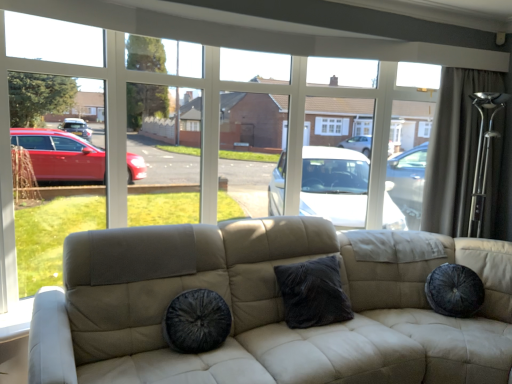
Question: Can you confirm if dark gray fabric curtain at upper right is thinner than velvet dark gray pillow at center?

Choices:
 (A) no
 (B) yes

Answer: (B)

Question: Considering the relative sizes of dark gray fabric curtain at upper right and velvet dark gray pillow at center in the image provided, is dark gray fabric curtain at upper right wider than velvet dark gray pillow at center?

Choices:
 (A) no
 (B) yes

Answer: (A)

Question: Can you confirm if dark gray fabric curtain at upper right is smaller than velvet dark gray pillow at center?

Choices:
 (A) yes
 (B) no

Answer: (B)

Question: Could you tell me if dark gray fabric curtain at upper right is facing velvet dark gray pillow at center?

Choices:
 (A) yes
 (B) no

Answer: (B)

Question: Is dark gray fabric curtain at upper right taller than velvet dark gray pillow at center?

Choices:
 (A) yes
 (B) no

Answer: (A)

Question: Is dark gray fabric curtain at upper right further to camera compared to velvet dark gray pillow at center?

Choices:
 (A) no
 (B) yes

Answer: (B)

Question: Is velvet black dog bed at center located outside velvet dark gray pillow at center?

Choices:
 (A) yes
 (B) no

Answer: (A)

Question: Is the depth of velvet black dog bed at center greater than that of velvet dark gray pillow at center?

Choices:
 (A) no
 (B) yes

Answer: (A)

Question: Considering the relative sizes of velvet black dog bed at center and velvet dark gray pillow at center in the image provided, is velvet black dog bed at center bigger than velvet dark gray pillow at center?

Choices:
 (A) no
 (B) yes

Answer: (A)

Question: Is there a large distance between velvet black dog bed at center and velvet dark gray pillow at center?

Choices:
 (A) yes
 (B) no

Answer: (B)

Question: From a real-world perspective, is velvet black dog bed at center under velvet dark gray pillow at center?

Choices:
 (A) yes
 (B) no

Answer: (A)

Question: From a real-world perspective, is velvet black dog bed at center physically above velvet dark gray pillow at center?

Choices:
 (A) yes
 (B) no

Answer: (B)

Question: From the image's perspective, would you say velvet dark gray pillow at center is positioned over velvet black dog bed at center?

Choices:
 (A) yes
 (B) no

Answer: (A)